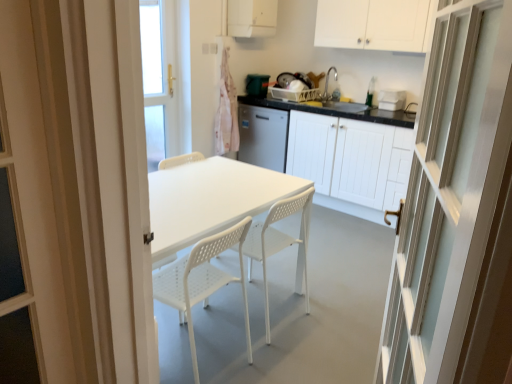
Question: Should I look upward or downward to see white matte cabinet at center, the 3th cabinetry from the top?

Choices:
 (A) up
 (B) down

Answer: (A)

Question: Is the depth of white matte cabinet at center, the 1th cabinetry positioned from the bottom, less than that of white plastic container at upper right, the 2th appliance from the left?

Choices:
 (A) yes
 (B) no

Answer: (A)

Question: Is white plastic container at upper right, the 2th appliance when ordered from top to bottom, a part of white matte cabinet at center, the 1th cabinetry positioned from the bottom?

Choices:
 (A) yes
 (B) no

Answer: (B)

Question: From a real-world perspective, is white matte cabinet at center, the 1th cabinetry positioned from the bottom, located beneath white plastic container at upper right, arranged as the second appliance when viewed from the back?

Choices:
 (A) yes
 (B) no

Answer: (A)

Question: Is white matte cabinet at center, the 1th cabinetry positioned from the bottom, aimed at white plastic container at upper right, which is the 1th appliance from right to left?

Choices:
 (A) yes
 (B) no

Answer: (B)

Question: Is white matte cabinet at center, the 1th cabinetry positioned from the bottom, bigger than white plastic container at upper right, the 2th appliance when ordered from top to bottom?

Choices:
 (A) yes
 (B) no

Answer: (A)

Question: Does white glossy door at right appear on the left side of white matte cabinet at center, the 3th cabinetry from the top?

Choices:
 (A) yes
 (B) no

Answer: (A)

Question: Considering the relative positions of white glossy door at right and white matte cabinet at center, the 1th cabinetry positioned from the bottom, in the image provided, is white glossy door at right to the right of white matte cabinet at center, the 1th cabinetry positioned from the bottom, from the viewer's perspective?

Choices:
 (A) yes
 (B) no

Answer: (B)

Question: Is white glossy door at right turned away from white matte cabinet at center, the 1th cabinetry positioned from the bottom?

Choices:
 (A) no
 (B) yes

Answer: (A)

Question: From a real-world perspective, is white glossy door at right below white matte cabinet at center, the 1th cabinetry positioned from the bottom?

Choices:
 (A) yes
 (B) no

Answer: (B)

Question: Can you see white glossy door at right touching white matte cabinet at center, the 1th cabinetry positioned from the bottom?

Choices:
 (A) no
 (B) yes

Answer: (A)

Question: Can you confirm if white glossy door at right is taller than white matte cabinet at center, the 1th cabinetry positioned from the bottom?

Choices:
 (A) yes
 (B) no

Answer: (A)

Question: Is white plastic container at upper right, the 2th appliance from the left, to the left of white plastic chair at center, which is the second chair in right-to-left order, from the viewer's perspective?

Choices:
 (A) no
 (B) yes

Answer: (A)